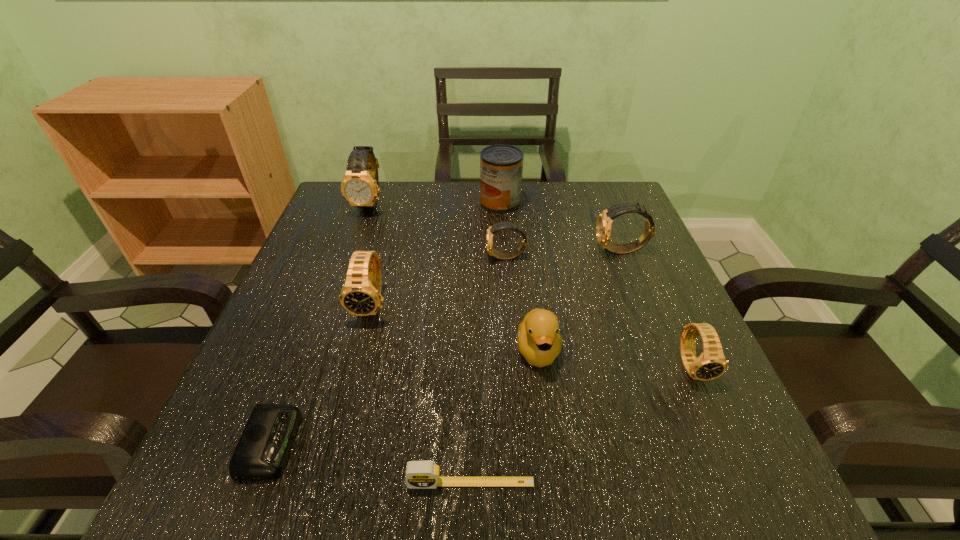
At what (x,y) coordinates should I click in order to perform the action: click on vacant area located 0.310m on the face of the third watch from left to right. Please return your answer as a coordinate pair (x, y). Looking at the image, I should click on click(x=349, y=258).

The height and width of the screenshot is (540, 960). Identify the location of free space located on the face of the third watch from left to right. (332, 258).

The width and height of the screenshot is (960, 540). Identify the location of vacant space located on the face of the third watch from left to right. (341, 258).

Find the location of a particular element. Image resolution: width=960 pixels, height=540 pixels. free space located on the face of the nearest watch is located at coordinates (714, 415).

Identify the location of free space located on the display of the shortest object. (494, 443).

What are the coordinates of `watch that is at the far edge` in the screenshot? It's located at (360, 187).

You are a GUI agent. You are given a task and a screenshot of the screen. Output one action in this format:
    pyautogui.click(x=<x>, y=<y>)
    Task: Click on the can located in the far edge section of the desktop
    The width and height of the screenshot is (960, 540).
    Given the screenshot: What is the action you would take?
    pyautogui.click(x=501, y=166)

The height and width of the screenshot is (540, 960). What are the coordinates of `tape measure located in the near edge section of the desktop` in the screenshot? It's located at (419, 474).

The image size is (960, 540). I want to click on alarm clock situated at the near edge, so [x=263, y=449].

Locate an element on the screen. This screenshot has width=960, height=540. alarm clock that is at the left edge is located at coordinates (263, 449).